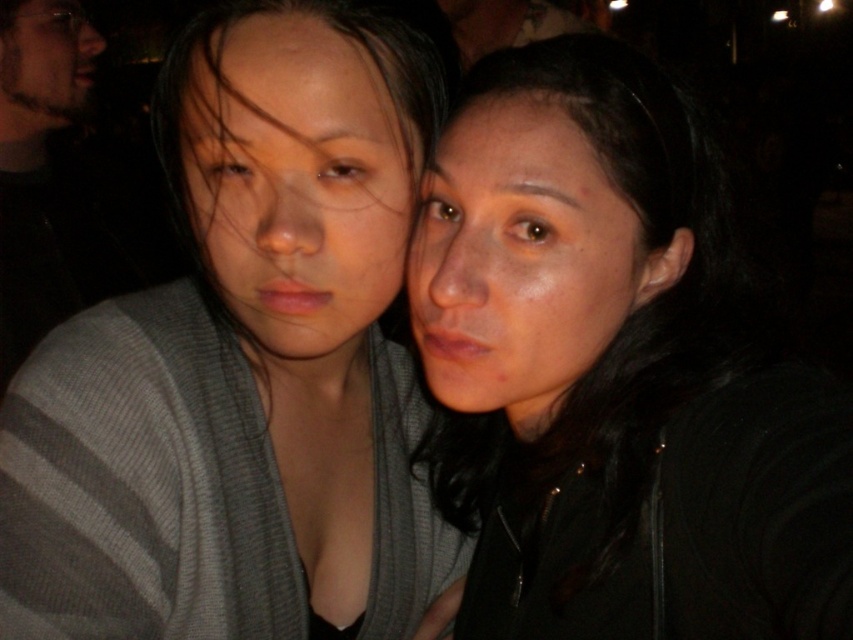
You are a photographer adjusting the lighting in this scene. You notice the gray knitted sweater at upper left and the beige textured beard at upper left. Which object is more to the left?

The gray knitted sweater at upper left is positioned on the left side of beige textured beard at upper left, so it is more to the left.

You are taking a photo of two points in the scene. The first point is labeled as point (432, 364) and the second is point (86, 26). If you want to focus on the point that is closer to you, which point should you choose?

You should focus on point (432, 364) because it is closer to the camera than point (86, 26).